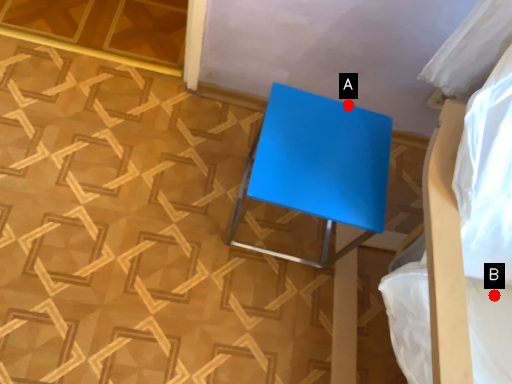
Question: Two points are circled on the image, labeled by A and B beside each circle. Which point is farther to the camera?

Choices:
 (A) A is further
 (B) B is further

Answer: (A)